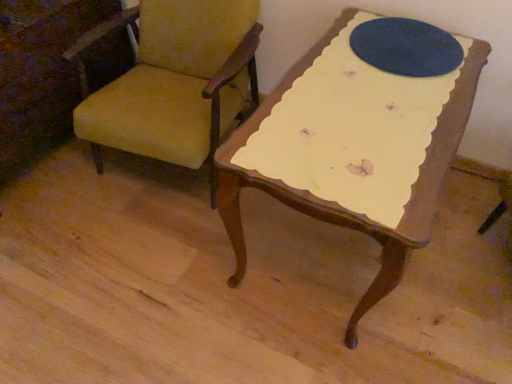
Question: Is yellow fabric chair at upper left in front of blue felt oval at upper center?

Choices:
 (A) no
 (B) yes

Answer: (B)

Question: Is yellow fabric chair at upper left shorter than blue felt oval at upper center?

Choices:
 (A) yes
 (B) no

Answer: (B)

Question: Can you see yellow fabric chair at upper left touching blue felt oval at upper center?

Choices:
 (A) yes
 (B) no

Answer: (B)

Question: Is yellow fabric chair at upper left oriented away from blue felt oval at upper center?

Choices:
 (A) no
 (B) yes

Answer: (A)

Question: Can you confirm if yellow fabric chair at upper left is bigger than blue felt oval at upper center?

Choices:
 (A) no
 (B) yes

Answer: (B)

Question: From a real-world perspective, is yellow fabric chair at upper left below blue felt oval at upper center?

Choices:
 (A) no
 (B) yes

Answer: (B)

Question: Does blue felt oval at upper center have a lesser height compared to yellow fabric chair at upper left?

Choices:
 (A) no
 (B) yes

Answer: (B)

Question: Is blue felt oval at upper center far away from yellow fabric chair at upper left?

Choices:
 (A) yes
 (B) no

Answer: (B)

Question: Is blue felt oval at upper center next to yellow fabric chair at upper left and touching it?

Choices:
 (A) yes
 (B) no

Answer: (B)

Question: From a real-world perspective, is blue felt oval at upper center physically above yellow fabric chair at upper left?

Choices:
 (A) yes
 (B) no

Answer: (A)

Question: From the image's perspective, would you say blue felt oval at upper center is positioned over yellow fabric chair at upper left?

Choices:
 (A) yes
 (B) no

Answer: (A)

Question: Is blue felt oval at upper center wider than yellow fabric chair at upper left?

Choices:
 (A) yes
 (B) no

Answer: (B)

Question: From a real-world perspective, is blue felt oval at upper center positioned above or below yellow fabric chair at upper left?

Choices:
 (A) below
 (B) above

Answer: (B)